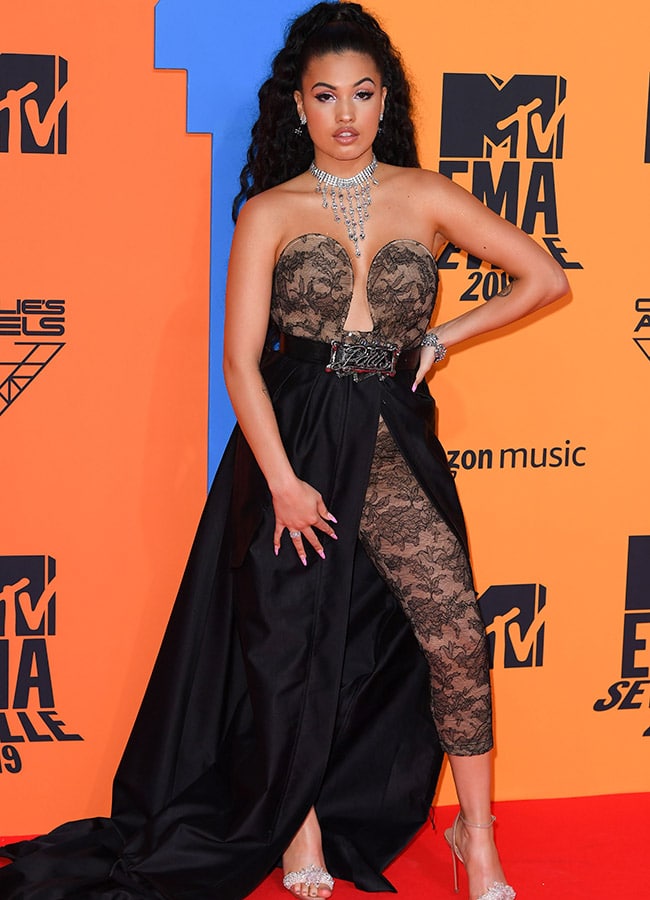
Where is `red carpet`? The image size is (650, 900). red carpet is located at coordinates (589, 810).